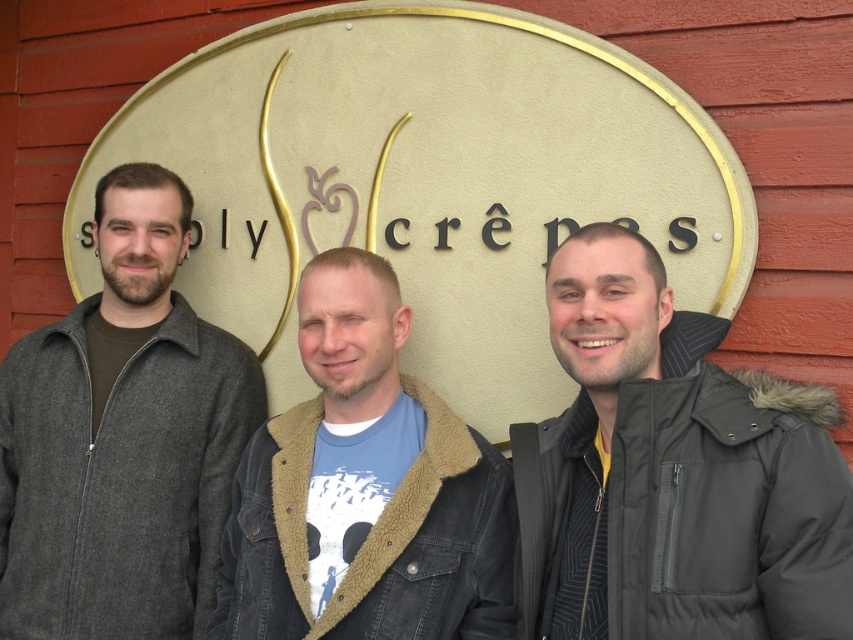
Between point (328, 42) and point (378, 493), which one is positioned behind?

The point (328, 42) is more distant.

What do you see at coordinates (425, 182) in the screenshot?
I see `matte gold sign at center` at bounding box center [425, 182].

This screenshot has width=853, height=640. In order to click on matte gold sign at center in this screenshot , I will do `click(425, 182)`.

Is matte gold sign at center wider than dark gray puffy jacket at center?

Yes.

Between point (425, 280) and point (697, 410), which one is positioned behind?

Point (425, 280)

Identify the location of matte gold sign at center. (425, 182).

Is dark gray puffy jacket at center positioned at the back of dark gray woolen jacket at left?

No, it is in front of dark gray woolen jacket at left.

Is point (752, 480) positioned after point (103, 236)?

No, it is in front of (103, 236).

Where is `dark gray puffy jacket at center`? Image resolution: width=853 pixels, height=640 pixels. dark gray puffy jacket at center is located at coordinates (672, 472).